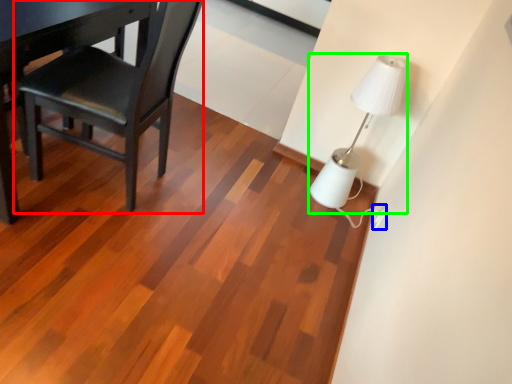
Question: Estimate the real-world distances between objects in this image. Which object is closer to chair (highlighted by a red box), electric outlet (highlighted by a blue box) or lamp (highlighted by a green box)?

Choices:
 (A) electric outlet
 (B) lamp

Answer: (B)